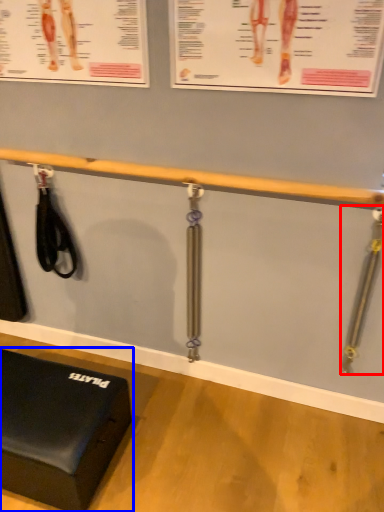
Question: Among these objects, which one is farthest to the camera, tool (highlighted by a red box) or furniture (highlighted by a blue box)?

Choices:
 (A) tool
 (B) furniture

Answer: (A)